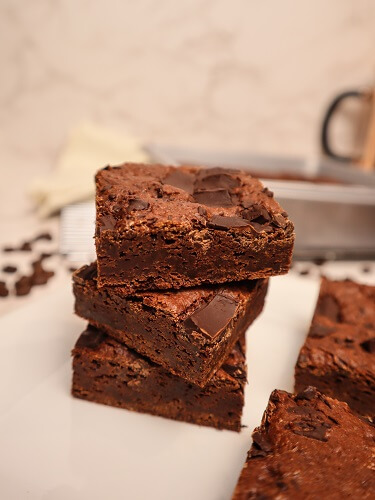
Find the location of a particular element. brownie pan is located at coordinates (287, 192).